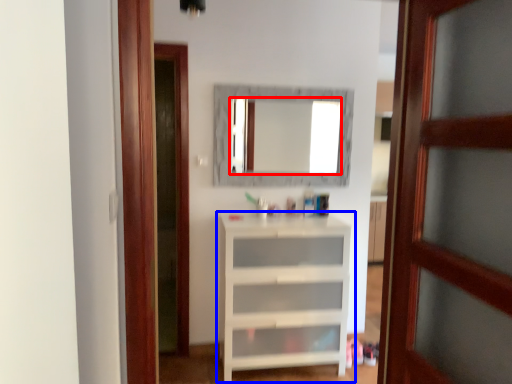
Question: Which of the following is the farthest to the observer, mirror (highlighted by a red box) or shelf (highlighted by a blue box)?

Choices:
 (A) mirror
 (B) shelf

Answer: (A)